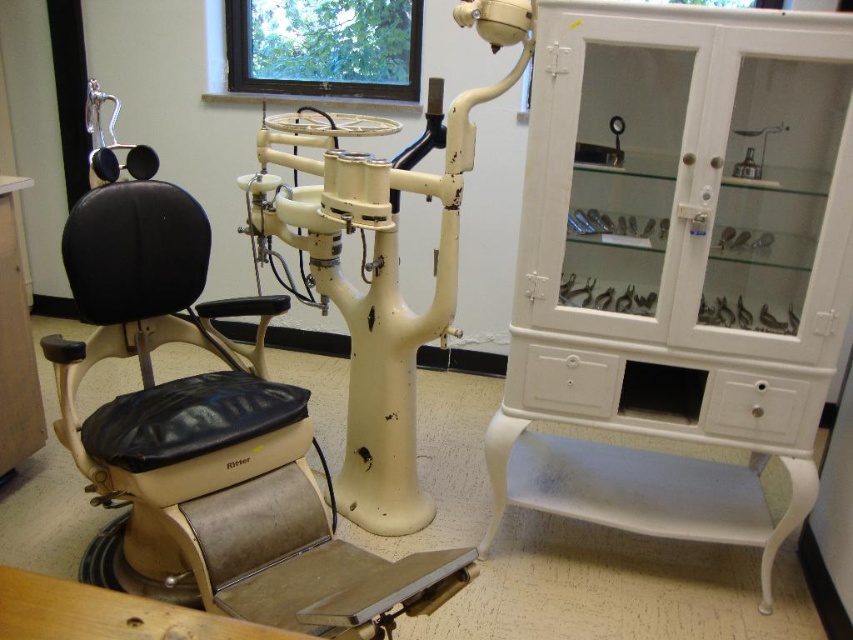
Question: Which point is closer to the camera?

Choices:
 (A) pyautogui.click(x=422, y=154)
 (B) pyautogui.click(x=825, y=323)

Answer: (B)

Question: Can you confirm if black leather swivel chair at left is positioned to the right of matte cream dental chair at center?

Choices:
 (A) yes
 (B) no

Answer: (B)

Question: Which of the following is the farthest from the observer?

Choices:
 (A) matte cream dental chair at center
 (B) black leather swivel chair at left
 (C) white glossy cabinet at right

Answer: (A)

Question: Is white glossy cabinet at right bigger than black leather swivel chair at left?

Choices:
 (A) no
 (B) yes

Answer: (B)

Question: Among these objects, which one is nearest to the camera?

Choices:
 (A) black leather swivel chair at left
 (B) matte cream dental chair at center

Answer: (A)

Question: Is black leather swivel chair at left positioned at the back of matte cream dental chair at center?

Choices:
 (A) no
 (B) yes

Answer: (A)